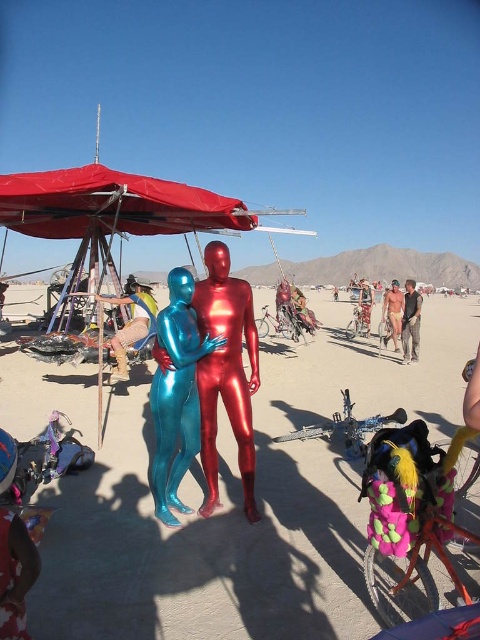
You are standing at the center of the desert festival scene. There is a point marked at coordinates (226, 372). Which object in the scene does this point correspond to?

The point at coordinates (226, 372) corresponds to the metallic red suit at center.

You are a photographer at the desert festival. You want to capture a photo of both the metallic red suit at center and the metallic blue suit at center. Which one should you focus on first if you want to include both in your frame without moving the camera?

The metallic blue suit at center is to the left of the metallic red suit at center, so focusing on the metallic blue suit at center first would allow you to frame both suits in the shot without needing to adjust the camera position.